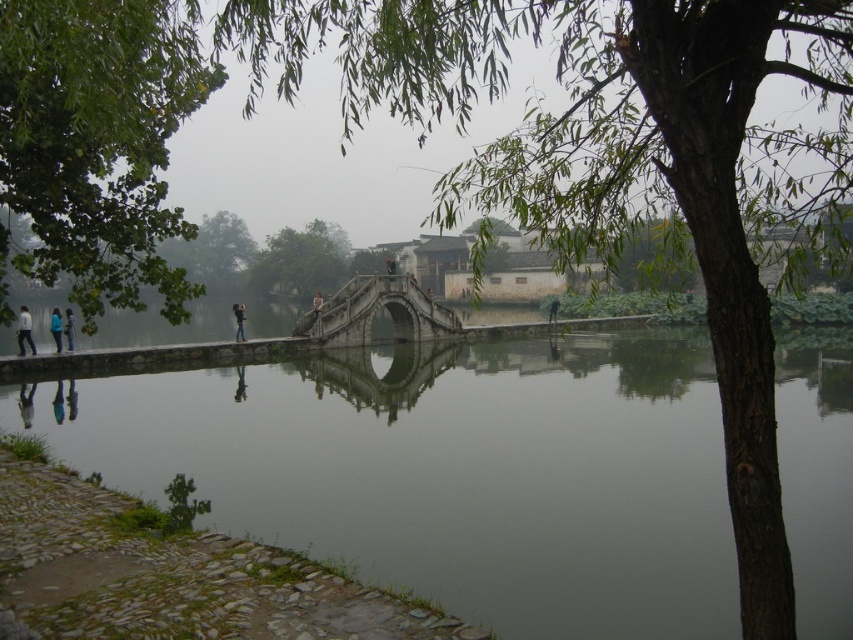
You are standing at the center of the stone bridge and see two points marked in the scene. The first point is at coordinates point (119,211) and the second point is at point (271,234). Which of these two points is closer to you?

Point (119,211) is in front of point (271,234), so the first point is closer to you.

Based on the photo, you are standing on the traditional stone bridge and looking towards the green leafy tree at upper right and the light blue jeans at center. Which object is closer to you?

The green leafy tree at upper right is closer to you because it is in front of the light blue jeans at center.

You are standing at the center of the traditional stone bridge and want to take a photo of the green leafy tree at left. Which direction should you face to capture the tree in your view?

The green leafy tree at left is located at point (97, 144), which is to the left side of the bridge. Therefore, you should face to the left direction to capture the tree in your view.